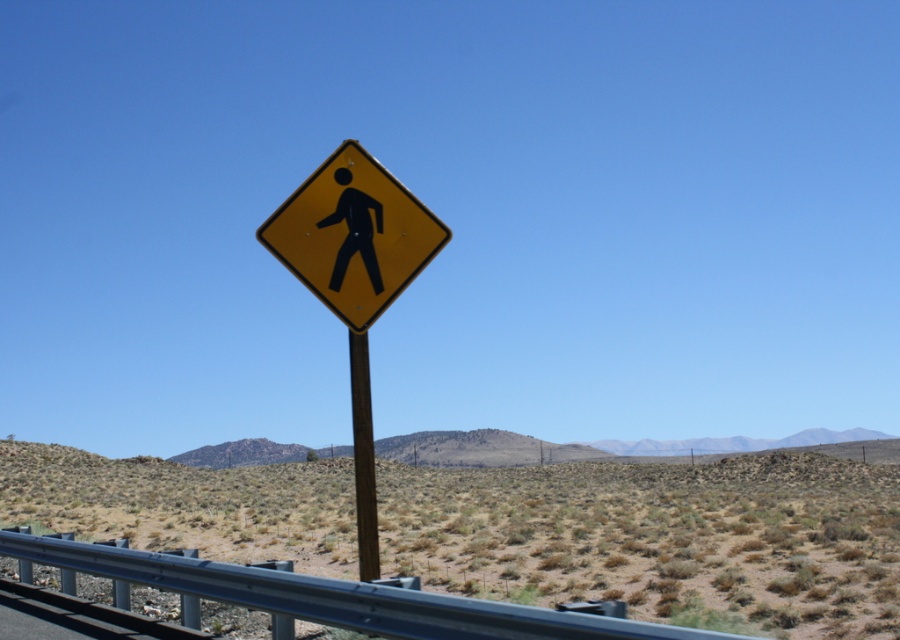
You are a drone operator trying to capture a photo of the pedestrian crossing sign. You notice two points in the scene marked as point 1 and point 2. If point 1 is at coordinates point (384, 564) and point 2 is at point (324, 221), which point is closer to the camera so you can focus there?

Point (324, 221) is closer to the camera than point (384, 564), so you should focus there.

You are a hiker trying to navigate through the dried grass at center and the brown wooden pole at center. Which one is larger in size?

The dried grass at center is bigger than the brown wooden pole at center.

You are a hiker standing at the edge of the road where the dried grass at center and the brown wooden pole at center are located. Which object is closer to you?

The dried grass at center is further to the viewer than the brown wooden pole at center, so the brown wooden pole at center is closer to you.